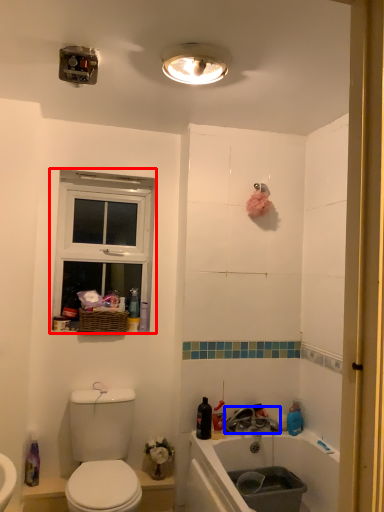
Question: Which object appears closest to the camera in this image, window (highlighted by a red box) or tap (highlighted by a blue box)?

Choices:
 (A) window
 (B) tap

Answer: (B)